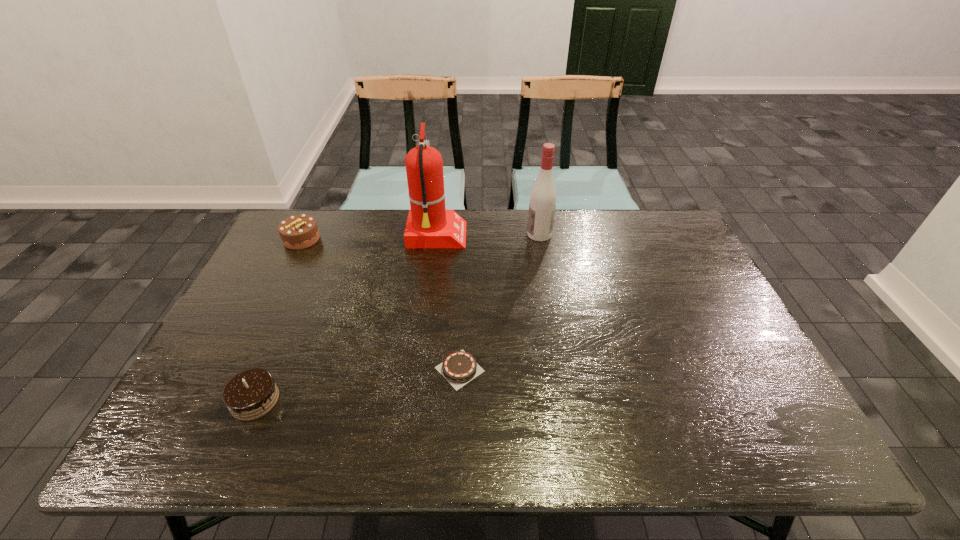
This screenshot has width=960, height=540. In order to click on free space at the right edge of the desktop in this screenshot , I will do `click(683, 320)`.

Locate an element on the screen. This screenshot has width=960, height=540. free space at the far right corner is located at coordinates (653, 252).

The width and height of the screenshot is (960, 540). I want to click on empty space between the alcohol and the shortest chocolate cake, so (499, 302).

At what (x,y) coordinates should I click in order to perform the action: click on free spot between the farthest chocolate cake and the fire extinguisher. Please return your answer as a coordinate pair (x, y). The image size is (960, 540). Looking at the image, I should click on (370, 238).

At what (x,y) coordinates should I click in order to perform the action: click on free spot between the shortest chocolate cake and the farthest chocolate cake. Please return your answer as a coordinate pair (x, y). Looking at the image, I should click on (381, 304).

What are the coordinates of `vacant region between the fire extinguisher and the rightmost object` in the screenshot? It's located at (488, 235).

At what (x,y) coordinates should I click in order to perform the action: click on vacant space in between the farthest chocolate cake and the fire extinguisher. Please return your answer as a coordinate pair (x, y). Image resolution: width=960 pixels, height=540 pixels. Looking at the image, I should click on (370, 238).

Locate which object ranks second in proximity to the farthest chocolate cake. Please provide its 2D coordinates. Your answer should be formatted as a tuple, i.e. [(x, y)], where the tuple contains the x and y coordinates of a point satisfying the conditions above.

[(250, 394)]

Where is `object that is the closest one to the farthest chocolate cake`? The height and width of the screenshot is (540, 960). object that is the closest one to the farthest chocolate cake is located at coordinates (429, 225).

At what (x,y) coordinates should I click in order to perform the action: click on the third closest chocolate cake to the fire extinguisher. Please return your answer as a coordinate pair (x, y). Looking at the image, I should click on (250, 394).